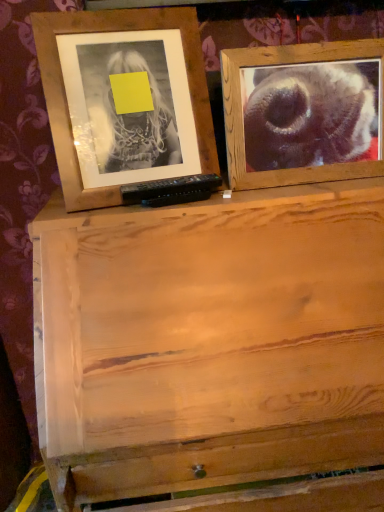
Question: Considering the relative positions of wooden frame at upper right, positioned as the second picture frame in left-to-right order, and wooden frame at upper left, placed as the second picture frame when sorted from right to left, in the image provided, is wooden frame at upper right, positioned as the second picture frame in left-to-right order, to the left or to the right of wooden frame at upper left, placed as the second picture frame when sorted from right to left,?

Choices:
 (A) right
 (B) left

Answer: (A)

Question: Is point (254, 111) positioned closer to the camera than point (168, 22)?

Choices:
 (A) closer
 (B) farther

Answer: (B)

Question: Which is correct: wooden frame at upper right, acting as the first picture frame starting from the right, is inside wooden frame at upper left, which is the 1th picture frame in left-to-right order, or outside of it?

Choices:
 (A) inside
 (B) outside

Answer: (B)

Question: In terms of width, does wooden frame at upper left, which is the 1th picture frame in left-to-right order, look wider or thinner when compared to wooden frame at upper right, acting as the first picture frame starting from the right?

Choices:
 (A) thin
 (B) wide

Answer: (B)

Question: From the image's perspective, is wooden frame at upper left, which is the 1th picture frame in left-to-right order, located above or below wooden frame at upper right, positioned as the second picture frame in left-to-right order?

Choices:
 (A) below
 (B) above

Answer: (B)

Question: In the image, is wooden frame at upper left, which is the 1th picture frame in left-to-right order, on the left side or the right side of wooden frame at upper right, positioned as the second picture frame in left-to-right order?

Choices:
 (A) left
 (B) right

Answer: (A)

Question: Based on their sizes in the image, would you say wooden frame at upper left, placed as the second picture frame when sorted from right to left, is bigger or smaller than wooden frame at upper right, positioned as the second picture frame in left-to-right order?

Choices:
 (A) small
 (B) big

Answer: (B)